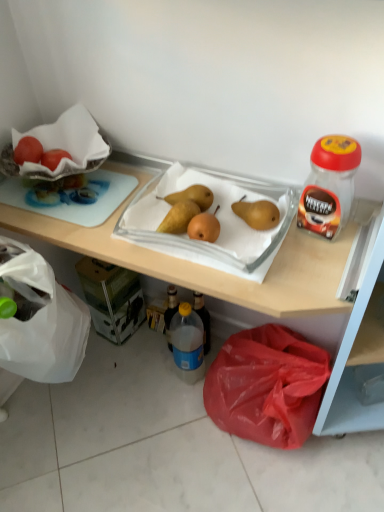
Find the location of a particular element. vacant area that is in front of translucent plastic bottle at lower center is located at coordinates (185, 428).